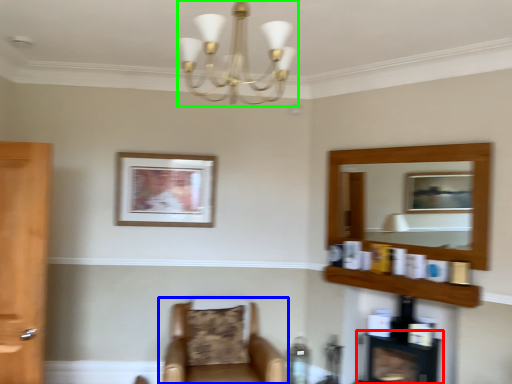
Question: Estimate the real-world distances between objects in this image. Which object is farther from fireplace (highlighted by a red box), chair (highlighted by a blue box) or light fixture (highlighted by a green box)?

Choices:
 (A) chair
 (B) light fixture

Answer: (B)